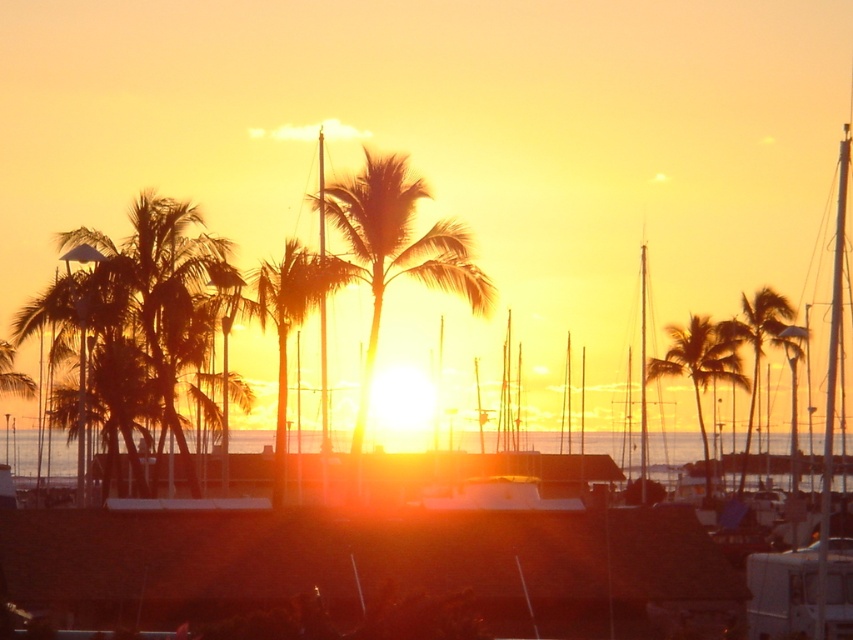
Is silky brown palm tree at center to the right of silky gold palm tree at right from the viewer's perspective?

Incorrect, silky brown palm tree at center is not on the right side of silky gold palm tree at right.

You are a GUI agent. You are given a task and a screenshot of the screen. Output one action in this format:
    pyautogui.click(x=<x>, y=<y>)
    Task: Click on the silky brown palm tree at center
    
    Given the screenshot: What is the action you would take?
    pyautogui.click(x=396, y=250)

How distant is silhouette leafy palm at center from silky gold palm tree at right?

silhouette leafy palm at center is 2.23 meters from silky gold palm tree at right.

Does silhouette leafy palm at center lie behind silky gold palm tree at right?

Yes, silhouette leafy palm at center is behind silky gold palm tree at right.

Where is `silhouette leafy palm at center`? silhouette leafy palm at center is located at coordinates coord(701,364).

Between point (4, 442) and point (699, 380), which one is positioned in front?

Point (699, 380)

Does point (15, 456) come behind point (730, 376)?

Yes, it is.

This screenshot has height=640, width=853. What are the coordinates of `translucent water at center` in the screenshot? It's located at (19, 451).